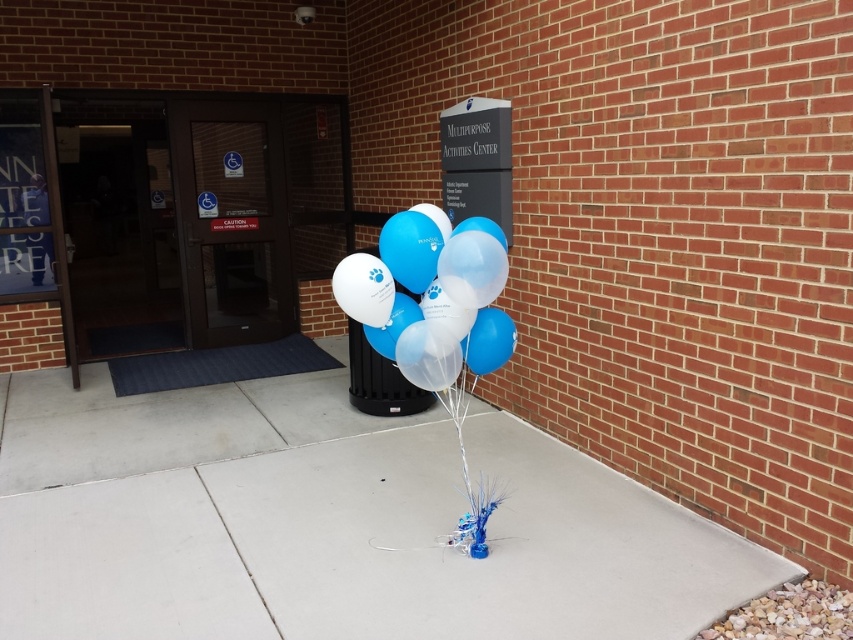
Consider the image. You are a delivery person trying to park your 1.2 meter wide cart in front of the entrance. The entrance has a white concrete pavement at center and translucent glossy balloons at center. Which area should you park in to ensure your cart fits without overlapping the balloons?

The white concrete pavement at center has a larger width than the translucent glossy balloons at center, so parking there would accommodate the cart without overlapping the balloons.

You are a delivery person carrying a heavy box and need to place it on the ground near the entrance. Which object, the white concrete pavement at center or the translucent glossy balloons at center, is more suitable for placing the box?

The white concrete pavement at center is more suitable because it has a lesser height compared to the translucent glossy balloons at center, making it a stable and flat surface for placing the box.